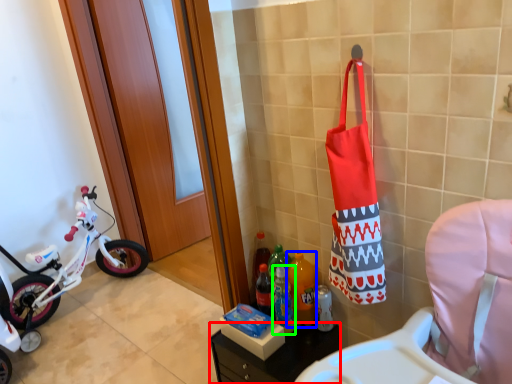
Question: Estimate the real-world distances between objects in this image. Which object is closer to furniture (highlighted by a red box), bottle (highlighted by a blue box) or bottle (highlighted by a green box)?

Choices:
 (A) bottle
 (B) bottle

Answer: (B)